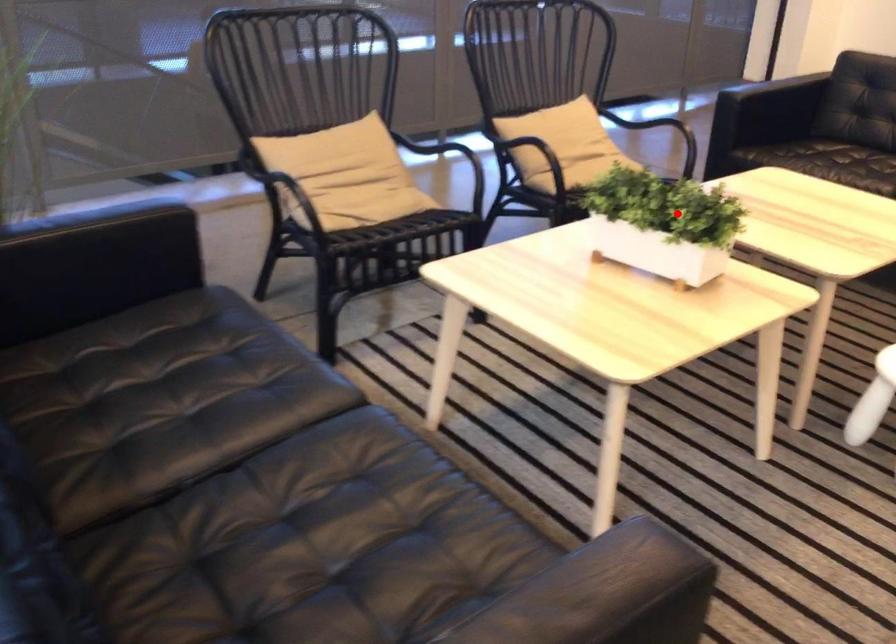
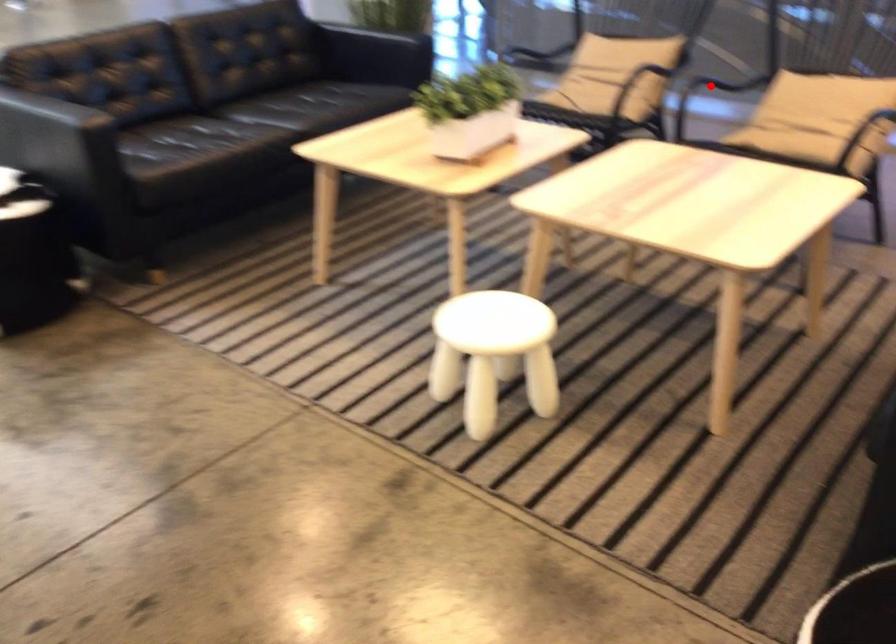
Looking at this image, I am providing you with two images of the same scene from different viewpoints. A red point is marked on the first image and another point is marked on the second image. Is the marked point in image1 the same physical position as the marked point in image2?

No